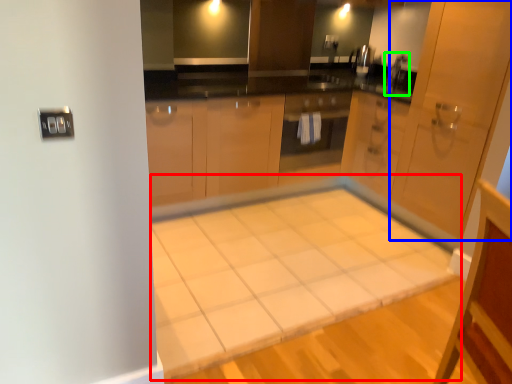
Question: Which object is positioned closest to table (highlighted by a red box)? Select from door (highlighted by a blue box) and faucet (highlighted by a green box).

Choices:
 (A) door
 (B) faucet

Answer: (A)